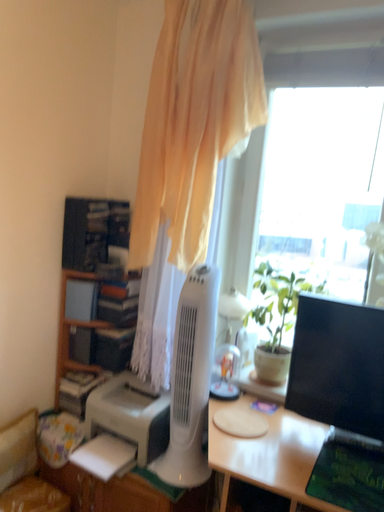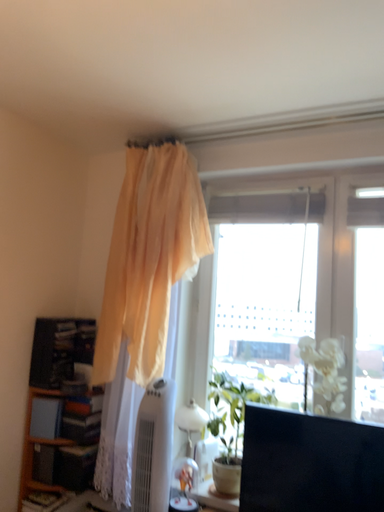
Question: Which way did the camera rotate in the video?

Choices:
 (A) rotated upward
 (B) rotated downward

Answer: (A)